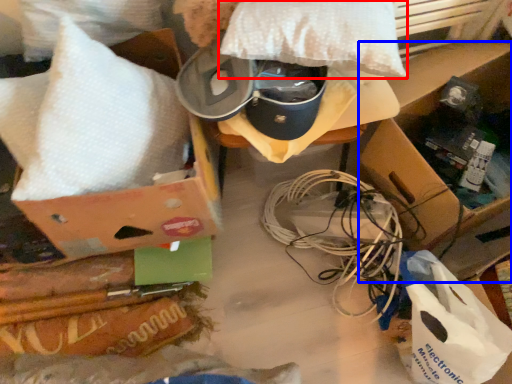
Question: Which point is closer to the camera, pillow (highlighted by a red box) or cardboard box (highlighted by a blue box)?

Choices:
 (A) pillow
 (B) cardboard box

Answer: (A)